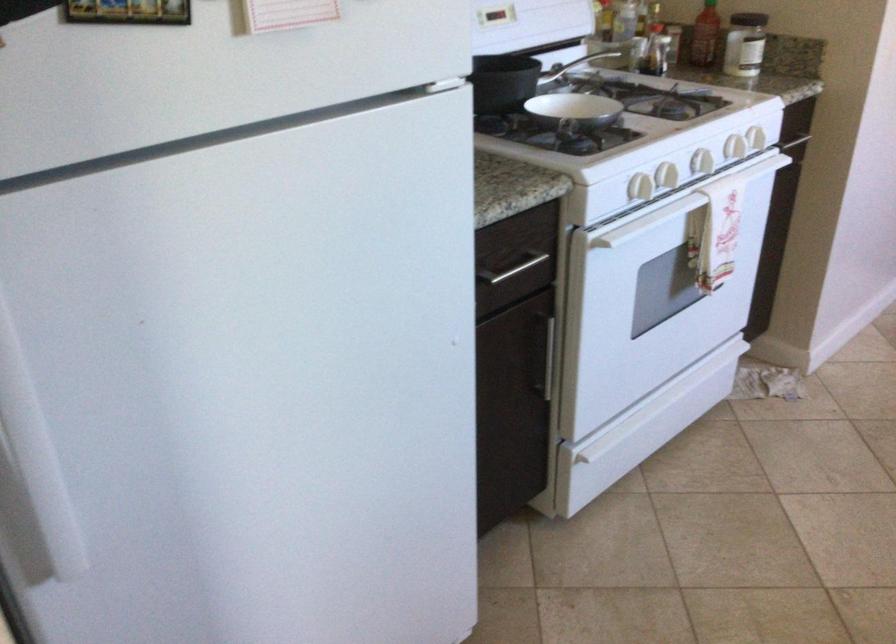
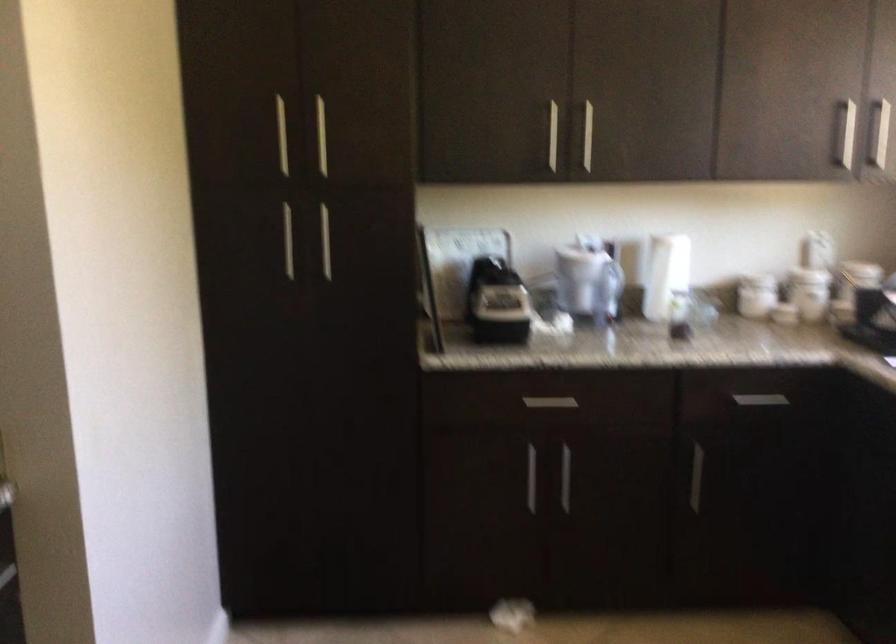
Question: The camera is either moving clockwise (left) or counter-clockwise (right) around the object. The first image is from the beginning of the video and the second image is from the end. Is the camera moving left or right when shooting the video?

Choices:
 (A) Left
 (B) Right

Answer: (A)